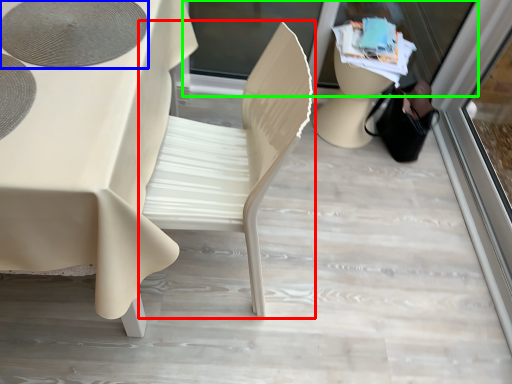
Question: Estimate the real-world distances between objects in this image. Which object is closer to chair (highlighted by a red box), oval (highlighted by a blue box) or shop window (highlighted by a green box)?

Choices:
 (A) oval
 (B) shop window

Answer: (A)